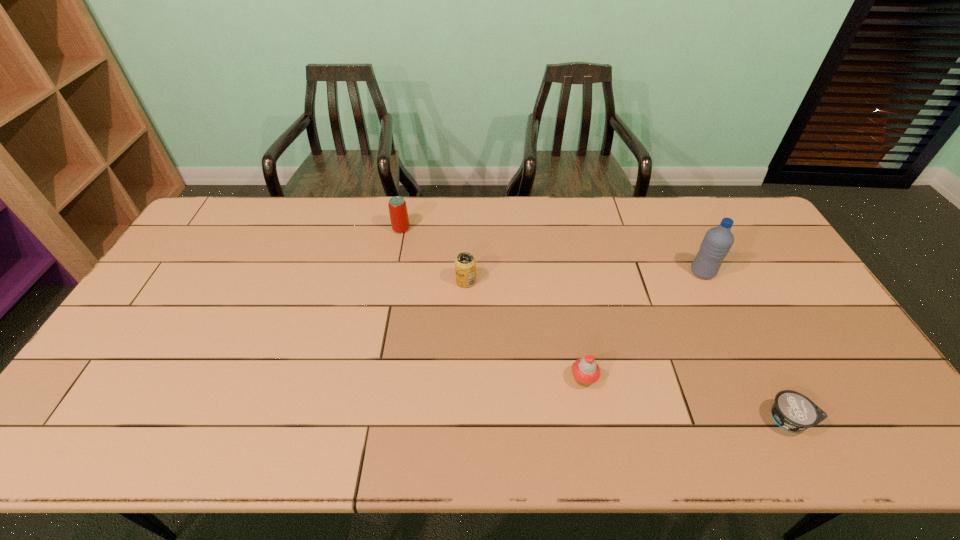
Where is `water bottle`? The width and height of the screenshot is (960, 540). water bottle is located at coordinates (717, 242).

Identify the location of the farthest object. (398, 212).

The width and height of the screenshot is (960, 540). In order to click on the farther beer can in this screenshot , I will do `click(398, 212)`.

You are a GUI agent. You are given a task and a screenshot of the screen. Output one action in this format:
    pyautogui.click(x=<x>, y=<y>)
    Task: Click on the second object from left to right
    Image resolution: width=960 pixels, height=540 pixels.
    Given the screenshot: What is the action you would take?
    pyautogui.click(x=465, y=264)

This screenshot has height=540, width=960. I want to click on the right beer can, so click(465, 264).

Identify the location of the fourth farthest object. (586, 371).

Locate an element on the screen. The image size is (960, 540). cupcake is located at coordinates (586, 371).

The height and width of the screenshot is (540, 960). Identify the location of the shortest object. (793, 411).

The width and height of the screenshot is (960, 540). I want to click on the nearest object, so click(793, 411).

Where is `free space located on the left of the tallest object`? free space located on the left of the tallest object is located at coordinates (671, 272).